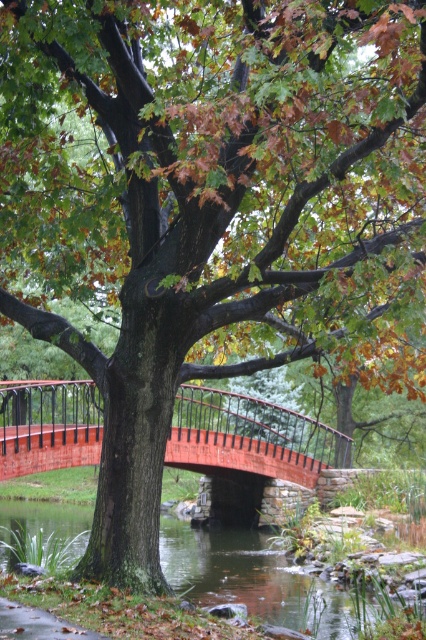
Based on the scene description, where is the wooden bridge at center located in terms of coordinates?

The wooden bridge at center is located at coordinates point (250, 436).

You are a photographer planning to take a photo of the wooden bridge at center and clear water at center. Based on their positions, which object will appear larger in the photo?

The wooden bridge at center will appear larger in the photo because it is taller than the clear water at center.